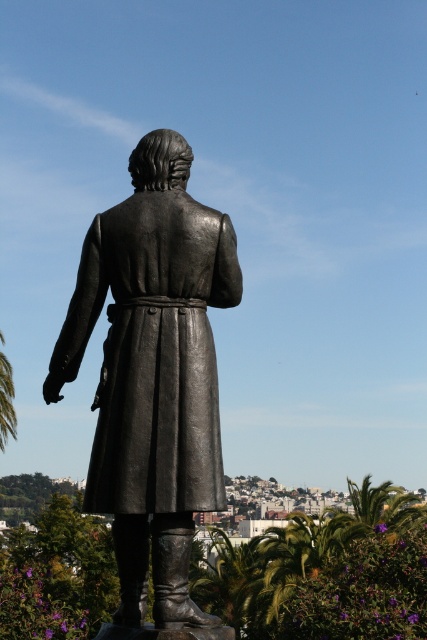
Looking at this image, you are standing in the park and see the polished bronze statue at center and the green leafy palm tree at lower left. Which object is positioned higher from the ground?

The polished bronze statue at center is located above the green leafy palm tree at lower left, so it is positioned higher from the ground.

You are a photographer planning to take a photo of the polished bronze statue at center and the green leafy palm tree at lower left. If you want to focus on the statue while keeping the palm tree in the background, will the current arrangement allow that?

Yes, because the polished bronze statue at center is closer to the viewer than the green leafy palm tree at lower left, so the statue can be in focus while the palm tree remains in the background.